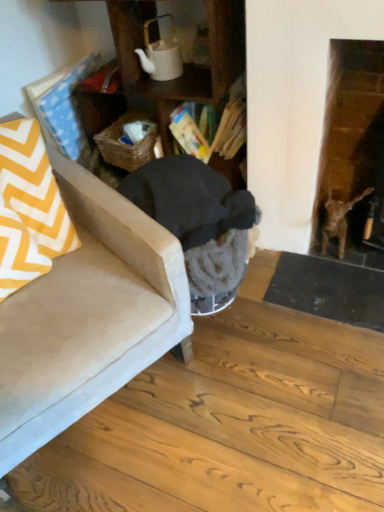
Question: Considering the relative sizes of woven brown basket at center and suede beige chair at lower left in the image provided, is woven brown basket at center bigger than suede beige chair at lower left?

Choices:
 (A) no
 (B) yes

Answer: (A)

Question: From the image's perspective, does woven brown basket at center appear higher than suede beige chair at lower left?

Choices:
 (A) no
 (B) yes

Answer: (B)

Question: Is woven brown basket at center positioned in front of suede beige chair at lower left?

Choices:
 (A) yes
 (B) no

Answer: (B)

Question: Considering the relative sizes of woven brown basket at center and suede beige chair at lower left in the image provided, is woven brown basket at center smaller than suede beige chair at lower left?

Choices:
 (A) yes
 (B) no

Answer: (A)

Question: Is woven brown basket at center facing away from suede beige chair at lower left?

Choices:
 (A) yes
 (B) no

Answer: (B)

Question: Considering the positions of woven brown basket at center and suede beige chair at lower left in the image, is woven brown basket at center bigger or smaller than suede beige chair at lower left?

Choices:
 (A) small
 (B) big

Answer: (A)

Question: In terms of width, does woven brown basket at center look wider or thinner when compared to suede beige chair at lower left?

Choices:
 (A) thin
 (B) wide

Answer: (A)

Question: Considering the positions of point (150, 147) and point (119, 281), is point (150, 147) closer or farther from the camera than point (119, 281)?

Choices:
 (A) farther
 (B) closer

Answer: (A)

Question: Considering the positions of woven brown basket at center and suede beige chair at lower left in the image, is woven brown basket at center taller or shorter than suede beige chair at lower left?

Choices:
 (A) short
 (B) tall

Answer: (A)

Question: Considering the relative positions of woven brown basket at center and yellow and white zigzag fabric at left in the image provided, is woven brown basket at center to the left or to the right of yellow and white zigzag fabric at left?

Choices:
 (A) left
 (B) right

Answer: (B)

Question: Is woven brown basket at center in front of or behind yellow and white zigzag fabric at left in the image?

Choices:
 (A) behind
 (B) front

Answer: (A)

Question: Looking at the image, does woven brown basket at center seem bigger or smaller compared to yellow and white zigzag fabric at left?

Choices:
 (A) small
 (B) big

Answer: (A)

Question: From a real-world perspective, is woven brown basket at center above or below yellow and white zigzag fabric at left?

Choices:
 (A) above
 (B) below

Answer: (B)

Question: Would you say yellow and white zigzag fabric at left is to the left or to the right of woven brown basket at center in the picture?

Choices:
 (A) right
 (B) left

Answer: (B)

Question: From a real-world perspective, is yellow and white zigzag fabric at left above or below woven brown basket at center?

Choices:
 (A) above
 (B) below

Answer: (A)